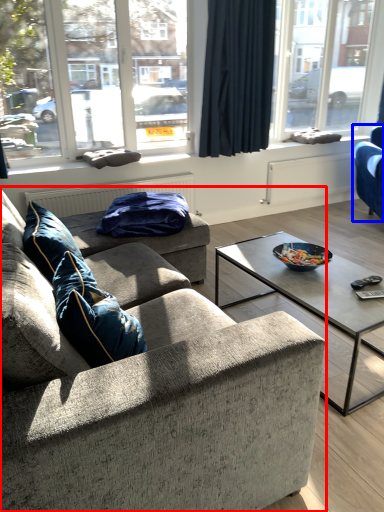
Question: Which object appears closest to the camera in this image, studio couch (highlighted by a red box) or studio couch (highlighted by a blue box)?

Choices:
 (A) studio couch
 (B) studio couch

Answer: (A)